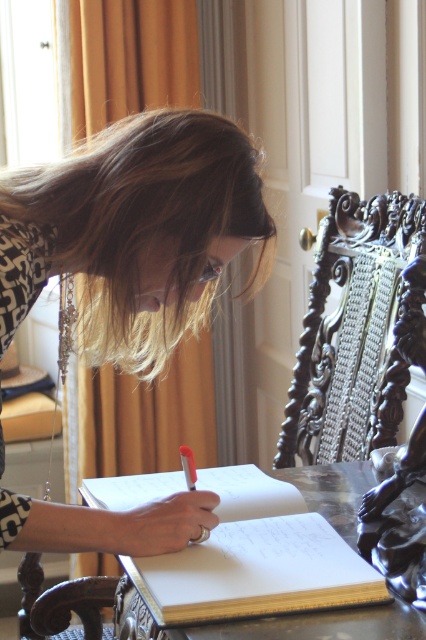
Which is in front, point (181, 284) or point (210, 636)?

Point (210, 636)

Can you confirm if blondehair at upper center is bigger than wooden table at center?

Indeed, blondehair at upper center has a larger size compared to wooden table at center.

Who is more distant from viewer, (164, 317) or (356, 516)?

The point (356, 516) is more distant.

This screenshot has height=640, width=426. I want to click on blondehair at upper center, so click(x=146, y=227).